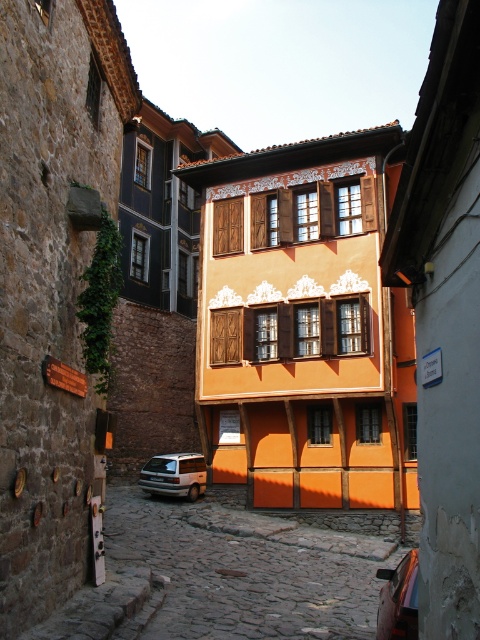
You are standing at the entrance of the orange building and want to walk to the cobblestone street at center. In which direction should you go?

The cobblestone street at center is located at point [248,573], so you should go forward to reach it.

You are a tourist standing on the cobblestone street at center and want to take a photo of the white matte van at lower center. Which direction should you move to get the van in your camera view?

The cobblestone street at center is to the right of the white matte van at lower center, so you should move to the left to get the van in your camera view.

You are a tourist standing on the cobblestone street at center and want to take a photo of the shiny black car at center. Which direction should you move to get the car in your camera frame?

The cobblestone street at center is positioned on the left side of the shiny black car at center, so you should move to the right to get the car in your camera frame.